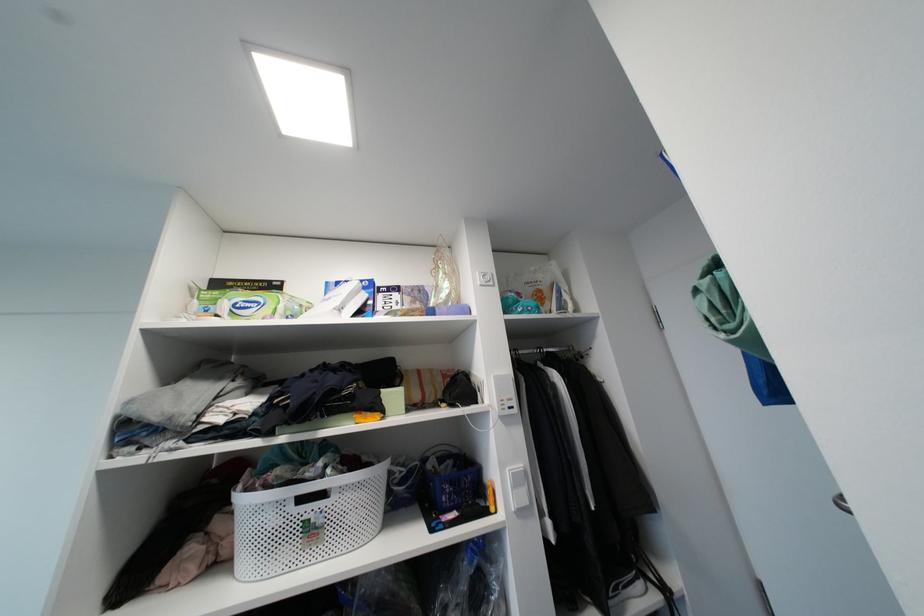
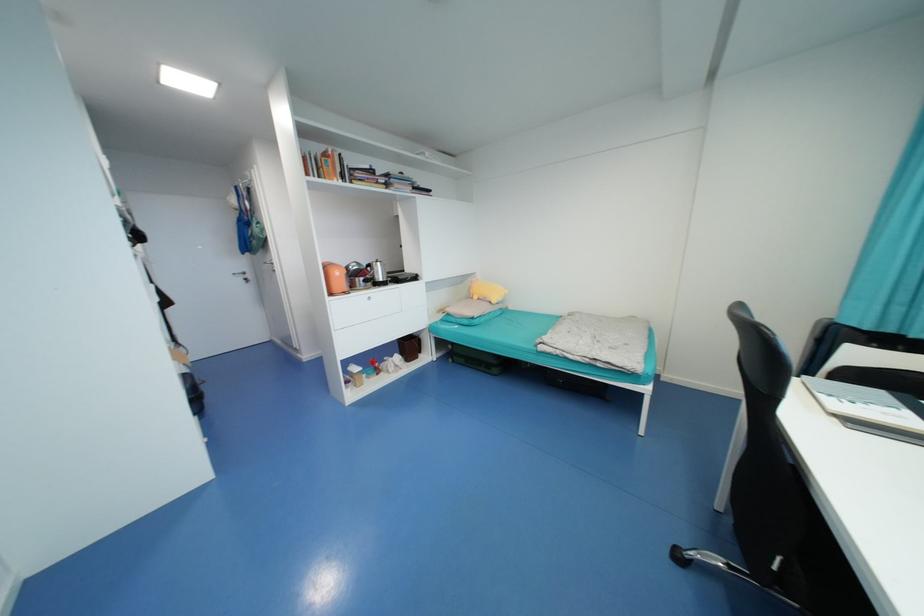
Question: I am providing you with two images of the same scene from different viewpoints. After the viewpoint changes to image2, which objects are now occluded?

Choices:
 (A) purple cardboard box
 (B) book
 (C) silver drawer knob
 (D) white basket handle

Answer: (D)